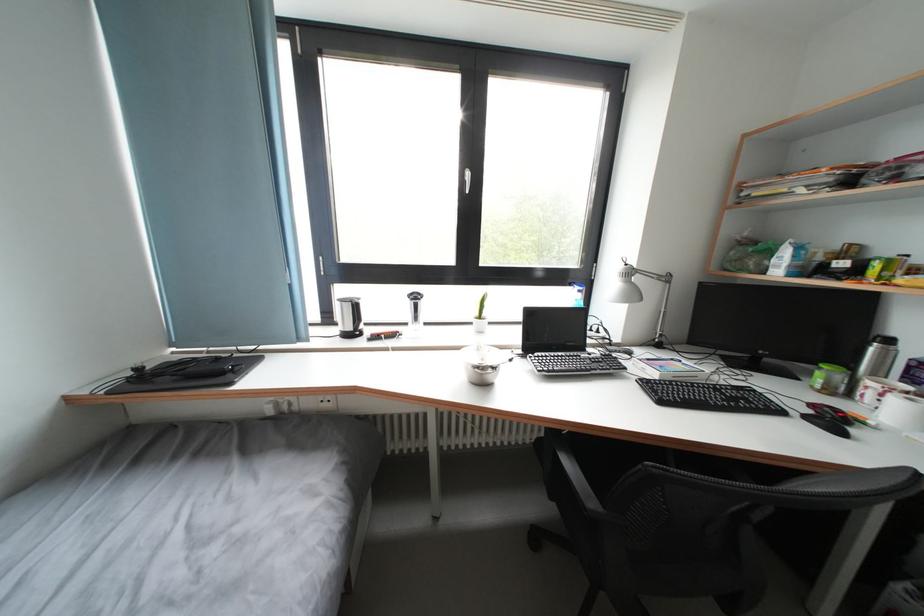
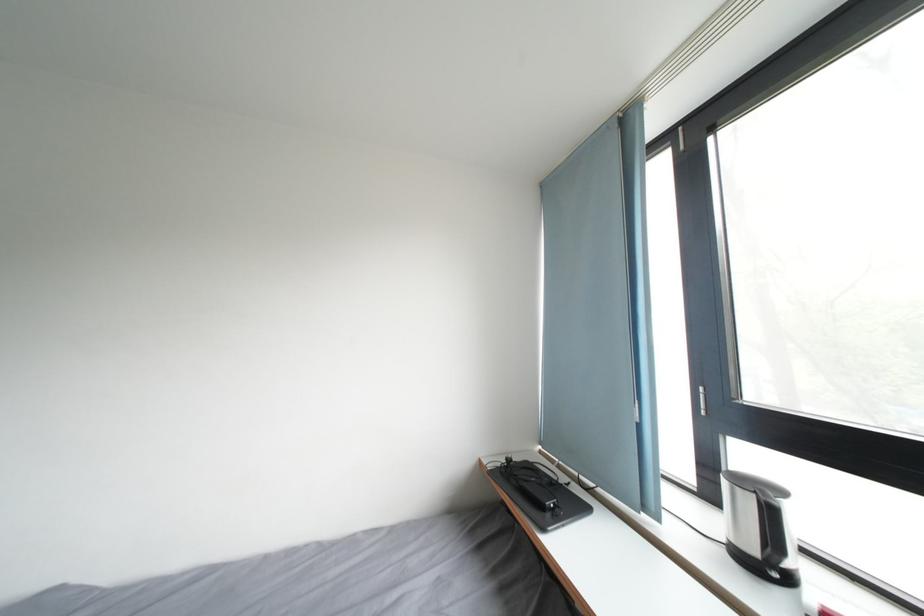
The point at (362, 312) is marked in the first image. Where is the corresponding point in the second image?

(776, 517)